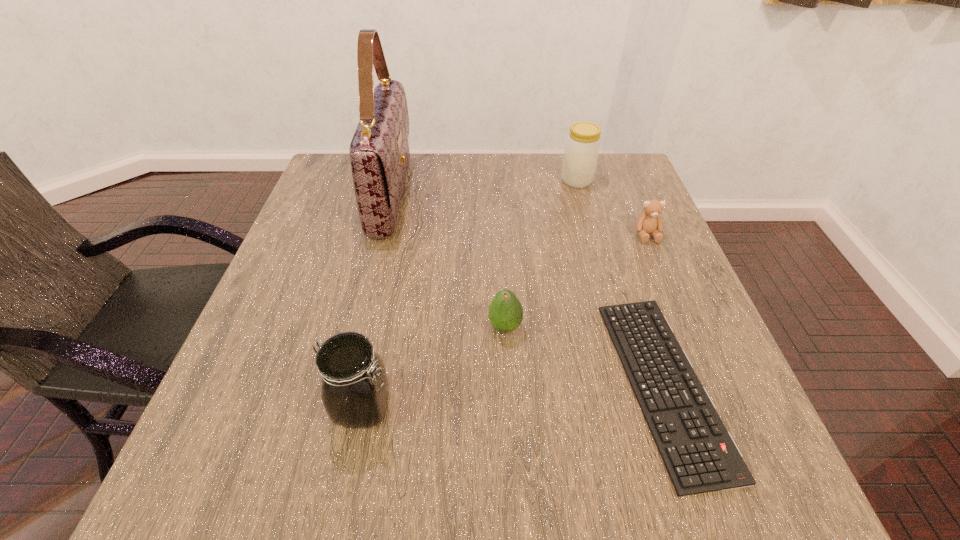
At what (x,y) coordinates should I click in order to perform the action: click on free space located on the face of the teddy bear. Please return your answer as a coordinate pair (x, y). Looking at the image, I should click on (666, 280).

Locate an element on the screen. This screenshot has height=540, width=960. free space located on the left of the computer keyboard is located at coordinates (571, 384).

Locate an element on the screen. The width and height of the screenshot is (960, 540). handbag that is at the far edge is located at coordinates pos(379,152).

Locate an element on the screen. This screenshot has height=540, width=960. jar that is at the far edge is located at coordinates (582, 147).

Identify the location of object that is positioned at the near edge. Image resolution: width=960 pixels, height=540 pixels. (700, 455).

Image resolution: width=960 pixels, height=540 pixels. Find the location of `object that is positioned at the left edge`. object that is positioned at the left edge is located at coordinates (379, 152).

The image size is (960, 540). What are the coordinates of `jar at the right edge` in the screenshot? It's located at (582, 147).

Where is `teddy bear that is at the right edge`? This screenshot has height=540, width=960. teddy bear that is at the right edge is located at coordinates tap(649, 222).

This screenshot has height=540, width=960. Find the location of `computer keyboard that is positioned at the right edge`. computer keyboard that is positioned at the right edge is located at coordinates pyautogui.click(x=700, y=455).

Where is `object that is at the far left corner`? Image resolution: width=960 pixels, height=540 pixels. object that is at the far left corner is located at coordinates (x=379, y=152).